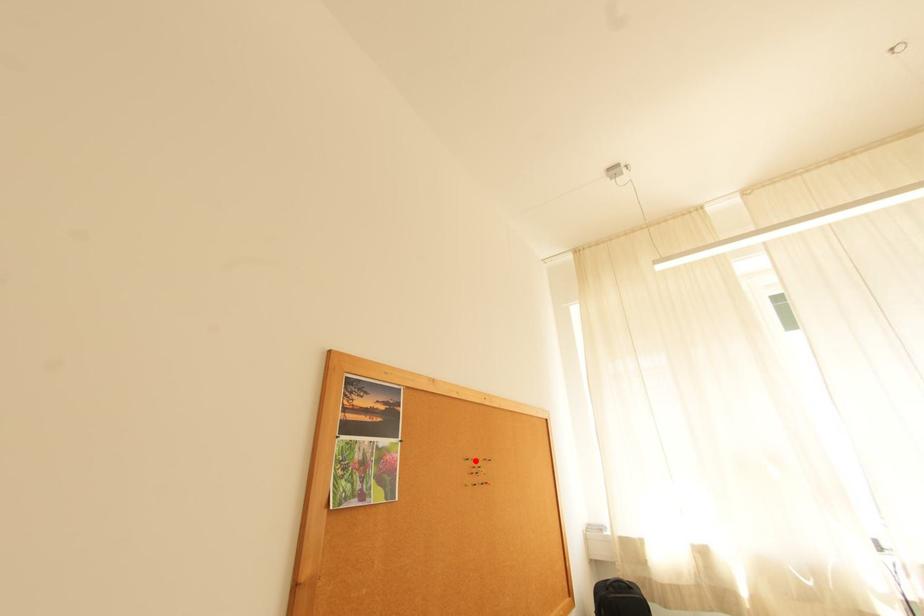
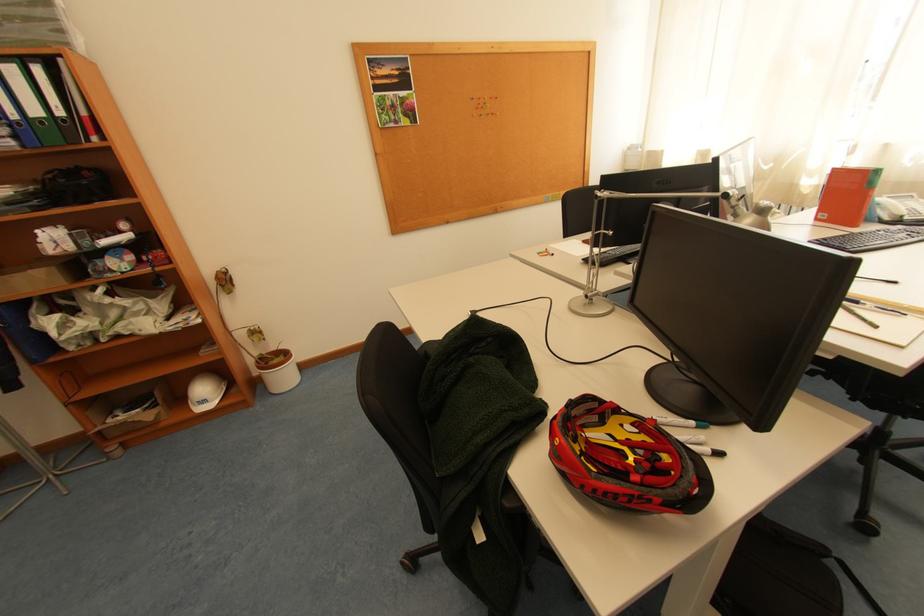
Find the pixel in the second image that matches the highlighted location in the first image.

(480, 100)